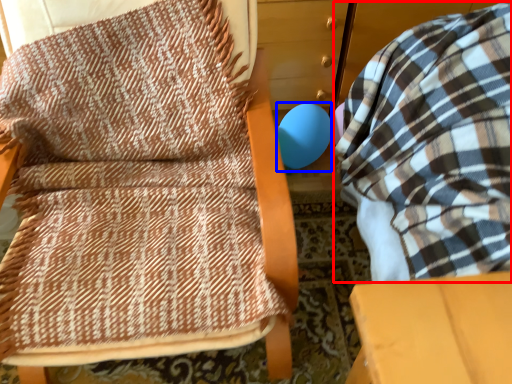
Question: Which point is closer to the camera, bean bag chair (highlighted by a red box) or balloon (highlighted by a blue box)?

Choices:
 (A) bean bag chair
 (B) balloon

Answer: (A)